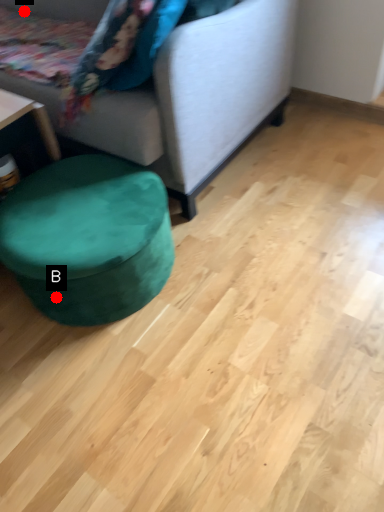
Question: Two points are circled on the image, labeled by A and B beside each circle. Which point is closer to the camera taking this photo?

Choices:
 (A) A is closer
 (B) B is closer

Answer: (B)